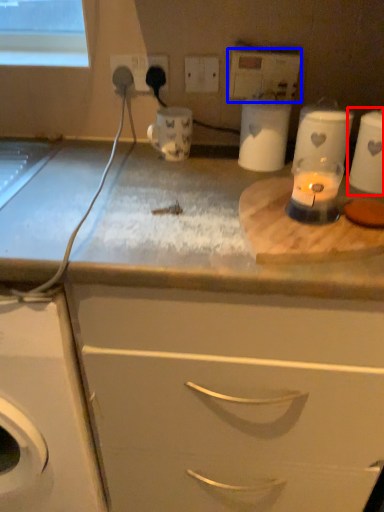
Question: Which of the following is the closest to the observer, appliance (highlighted by a red box) or electric outlet (highlighted by a blue box)?

Choices:
 (A) appliance
 (B) electric outlet

Answer: (A)